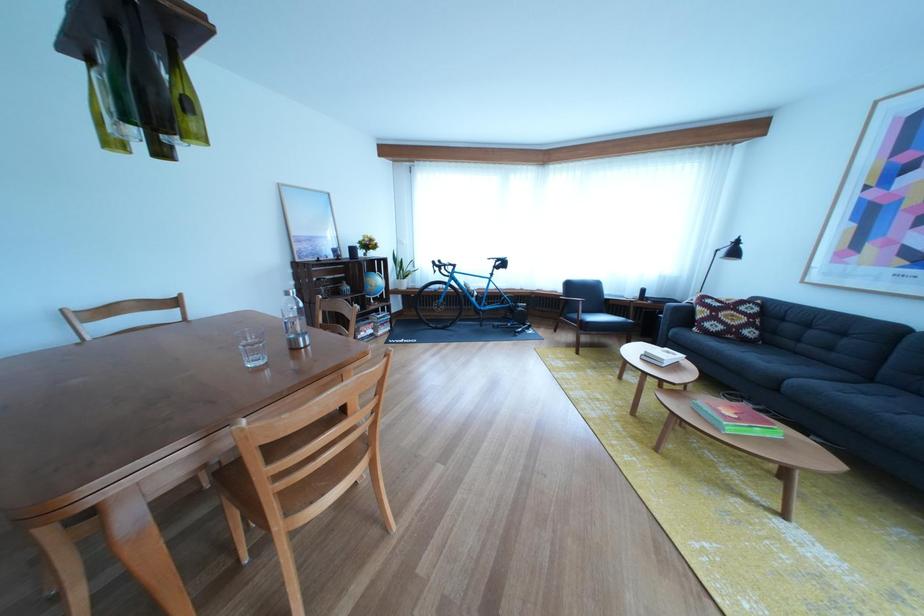
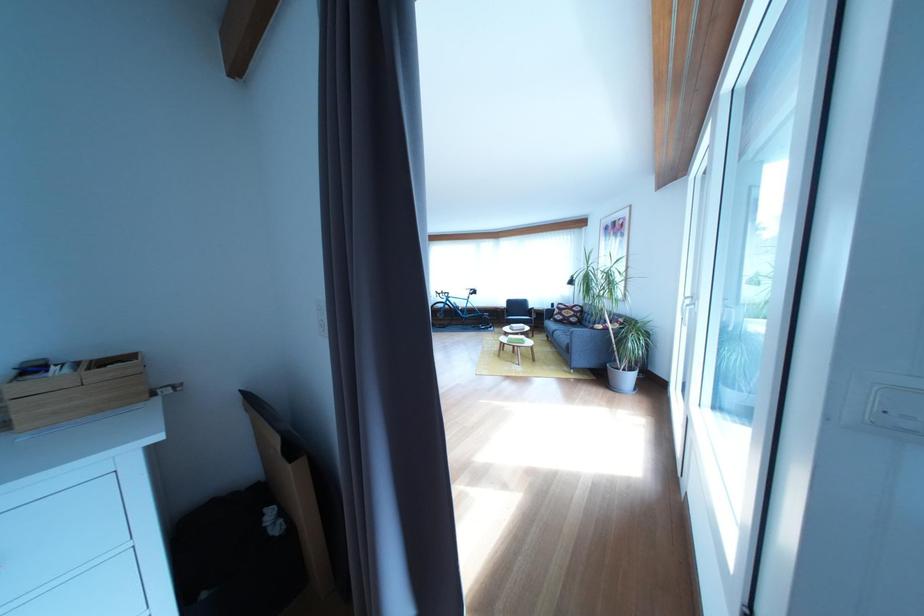
Where in the second image is the point corresponding to pixel 758 347 from the first image?

(585, 330)